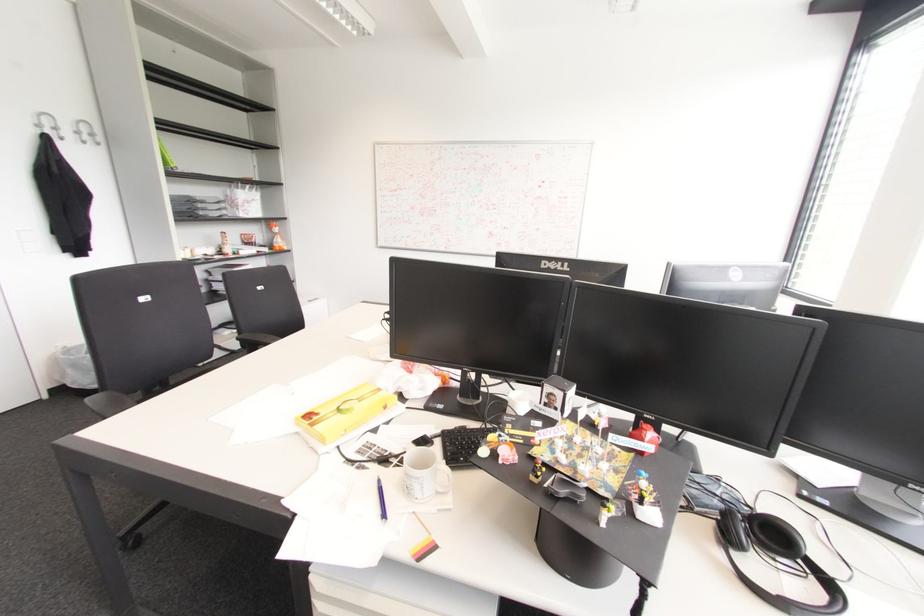
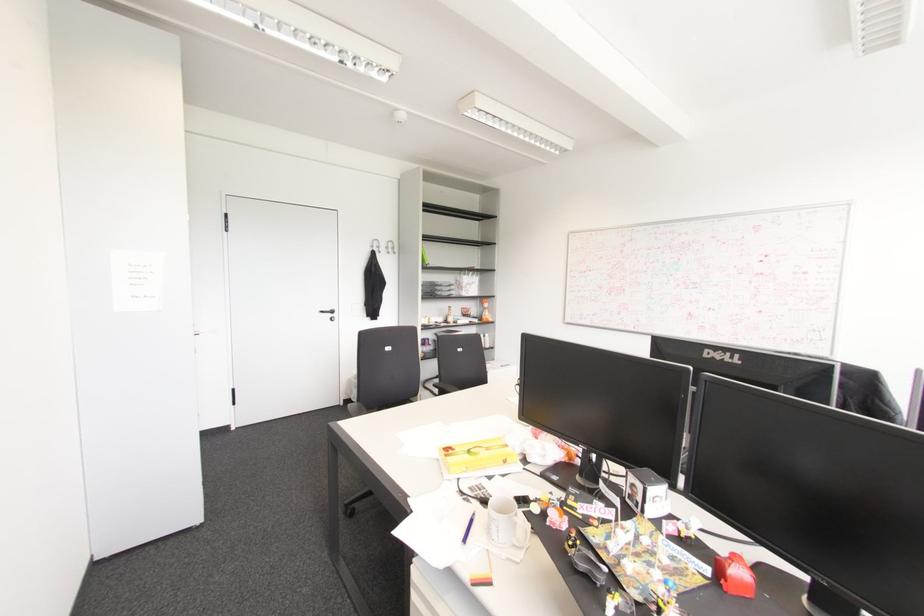
Locate, in the second image, the point that corresponds to [275,229] in the first image.

(485, 305)